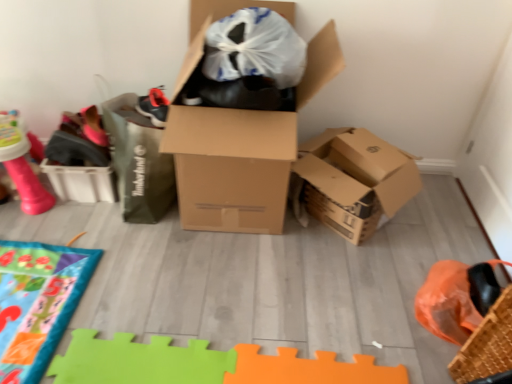
Question: Does pink rubber toy at upper left have a smaller size compared to woven brown basket at lower right?

Choices:
 (A) yes
 (B) no

Answer: (B)

Question: Is the position of pink rubber toy at upper left less distant than that of woven brown basket at lower right?

Choices:
 (A) yes
 (B) no

Answer: (B)

Question: Is pink rubber toy at upper left next to woven brown basket at lower right?

Choices:
 (A) yes
 (B) no

Answer: (B)

Question: Can you confirm if pink rubber toy at upper left is positioned to the left of woven brown basket at lower right?

Choices:
 (A) no
 (B) yes

Answer: (B)

Question: Does pink rubber toy at upper left have a greater height compared to woven brown basket at lower right?

Choices:
 (A) yes
 (B) no

Answer: (B)

Question: From the image's perspective, is pink rubber toy at upper left beneath woven brown basket at lower right?

Choices:
 (A) no
 (B) yes

Answer: (A)

Question: Is brown cardboard box at center far from woven brown basket at lower right?

Choices:
 (A) yes
 (B) no

Answer: (B)

Question: Is brown cardboard box at center thinner than woven brown basket at lower right?

Choices:
 (A) no
 (B) yes

Answer: (A)

Question: Is brown cardboard box at center facing away from woven brown basket at lower right?

Choices:
 (A) yes
 (B) no

Answer: (B)

Question: From the image's perspective, would you say brown cardboard box at center is positioned over woven brown basket at lower right?

Choices:
 (A) yes
 (B) no

Answer: (A)

Question: Is brown cardboard box at center in contact with woven brown basket at lower right?

Choices:
 (A) yes
 (B) no

Answer: (B)

Question: Does brown cardboard box at center appear on the left side of woven brown basket at lower right?

Choices:
 (A) yes
 (B) no

Answer: (A)

Question: From the image's perspective, is pink rubber toy at upper left under brown cardboard box at center?

Choices:
 (A) yes
 (B) no

Answer: (A)